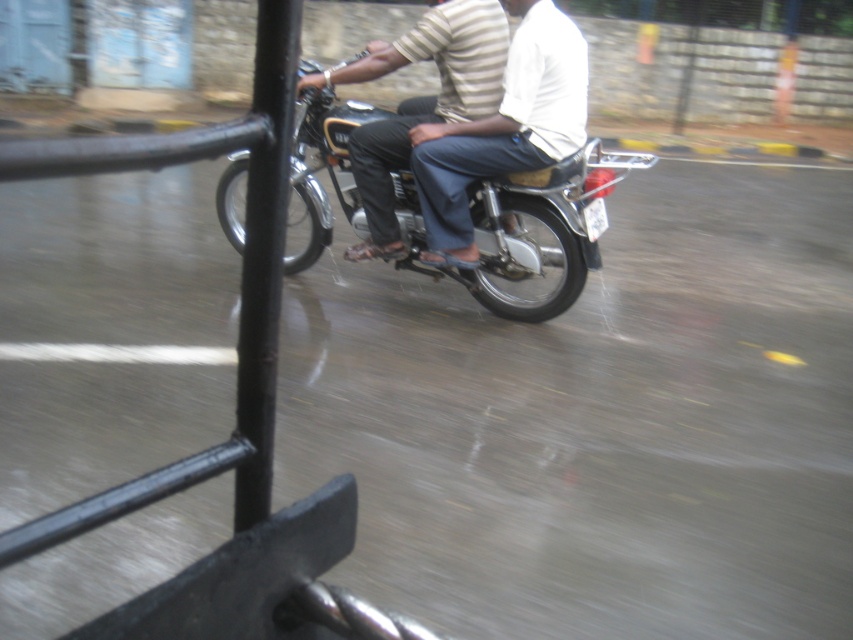
Question: Which point is closer to the camera?

Choices:
 (A) shiny metallic motorcycle at center
 (B) light brown striped shirt at center

Answer: (B)

Question: Which point is farther from the camera taking this photo?

Choices:
 (A) (312, 120)
 (B) (238, 404)
 (C) (389, 243)

Answer: (C)

Question: Can you confirm if shiny metallic motorcycle at center is positioned below striped cotton shirt at center?

Choices:
 (A) no
 (B) yes

Answer: (B)

Question: Which point appears closest to the camera in this image?

Choices:
 (A) (270, 28)
 (B) (456, 44)

Answer: (A)

Question: Does light brown striped shirt at center have a lesser width compared to striped cotton shirt at center?

Choices:
 (A) yes
 (B) no

Answer: (A)

Question: Is shiny metallic motorcycle at center above light brown striped shirt at center?

Choices:
 (A) yes
 (B) no

Answer: (B)